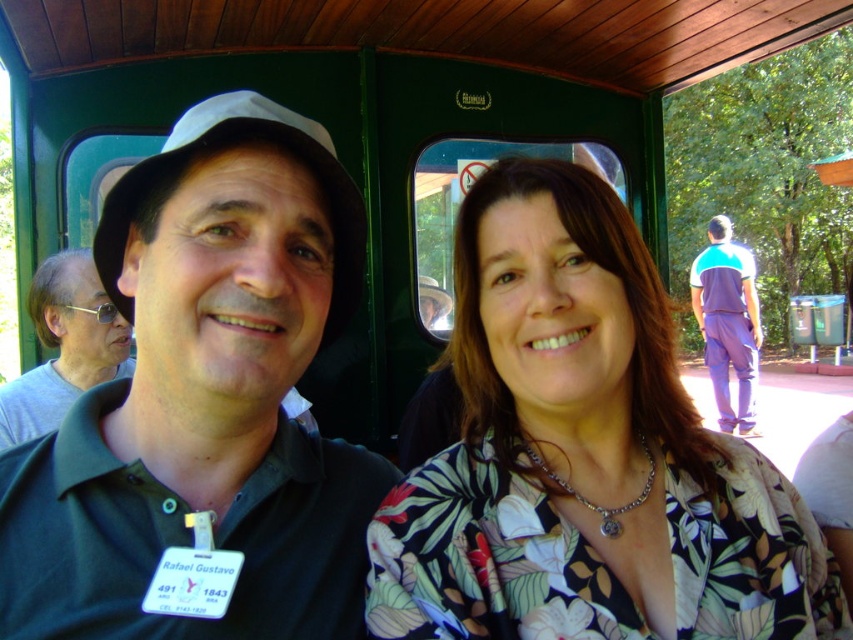
Who is lower down, floral print blouse at center or purple cotton pants at right?

purple cotton pants at right is lower down.

Is floral print blouse at center wider than purple cotton pants at right?

Indeed, floral print blouse at center has a greater width compared to purple cotton pants at right.

Is point (387, 616) more distant than point (753, 336)?

No, it is in front of (753, 336).

Locate an element on the screen. The width and height of the screenshot is (853, 640). floral print blouse at center is located at coordinates pyautogui.click(x=584, y=454).

Who is more forward, (114, 500) or (106, 374)?

Positioned in front is point (114, 500).

Locate an element on the screen. black matte hat at upper left is located at coordinates (206, 397).

Is floral print blouse at center shorter than black matte hat at upper left?

Yes.

Who is shorter, floral print blouse at center or black matte hat at upper left?

With less height is floral print blouse at center.

The height and width of the screenshot is (640, 853). I want to click on floral print blouse at center, so click(x=584, y=454).